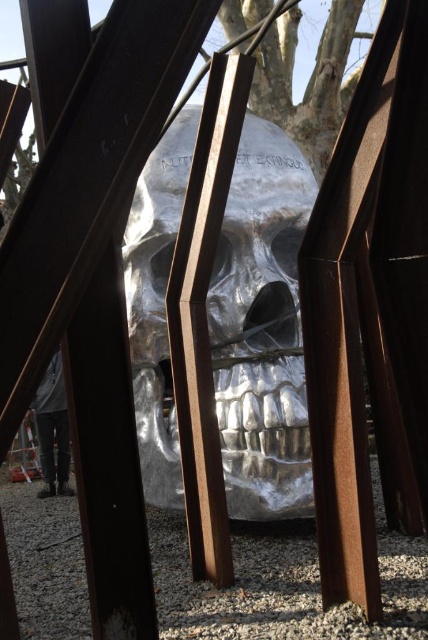
Question: Can you confirm if metallic silver skull at center is positioned to the left of gray fabric pants at lower left?

Choices:
 (A) yes
 (B) no

Answer: (B)

Question: Is metallic silver skull at center in front of gray fabric pants at lower left?

Choices:
 (A) no
 (B) yes

Answer: (B)

Question: Among these objects, which one is farthest from the camera?

Choices:
 (A) metallic silver skull at center
 (B) gray fabric pants at lower left

Answer: (B)

Question: Which of the following is the farthest from the observer?

Choices:
 (A) (243, 154)
 (B) (50, 388)

Answer: (B)

Question: Is metallic silver skull at center to the left of gray fabric pants at lower left from the viewer's perspective?

Choices:
 (A) no
 (B) yes

Answer: (A)

Question: Which point is closer to the camera taking this photo?

Choices:
 (A) (293, 220)
 (B) (59, 492)

Answer: (A)